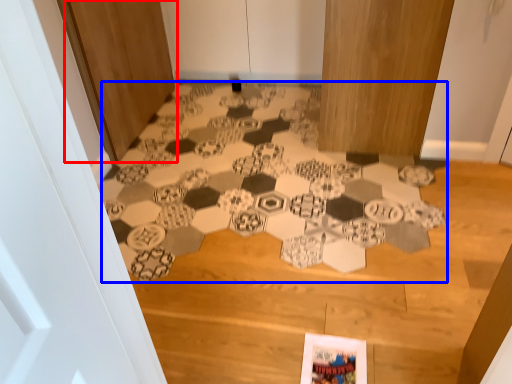
Question: Which object appears closest to the camera in this image, door (highlighted by a red box) or print (highlighted by a blue box)?

Choices:
 (A) door
 (B) print

Answer: (B)